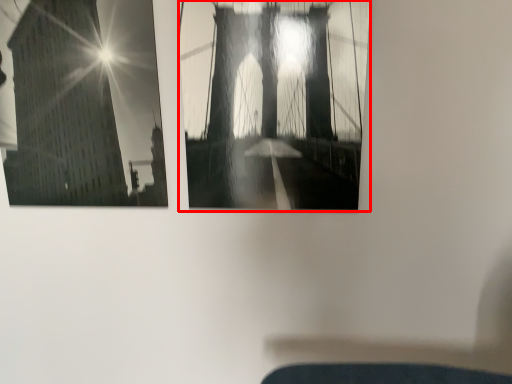
Question: In this image, where is window (annotated by the red box) located relative to window?

Choices:
 (A) right
 (B) left

Answer: (A)